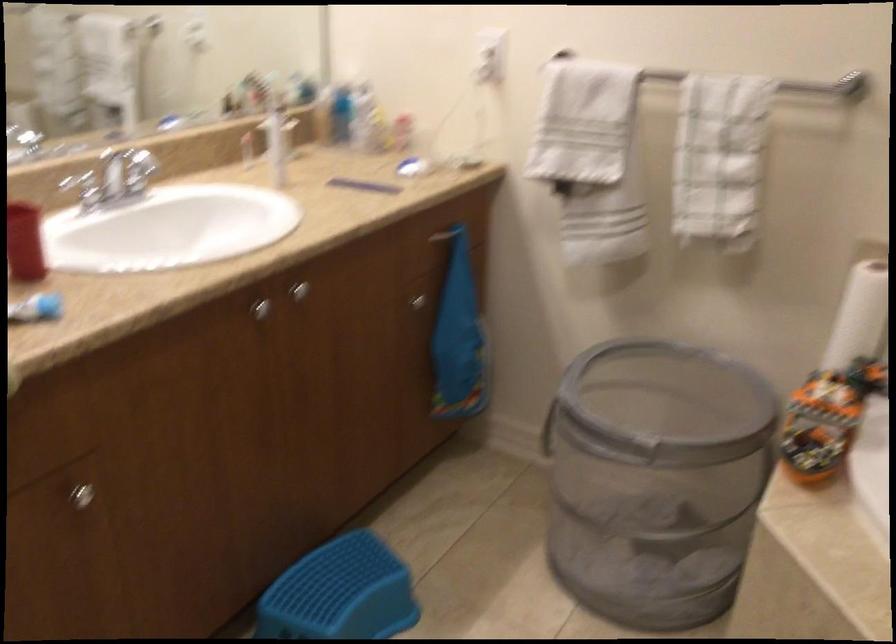
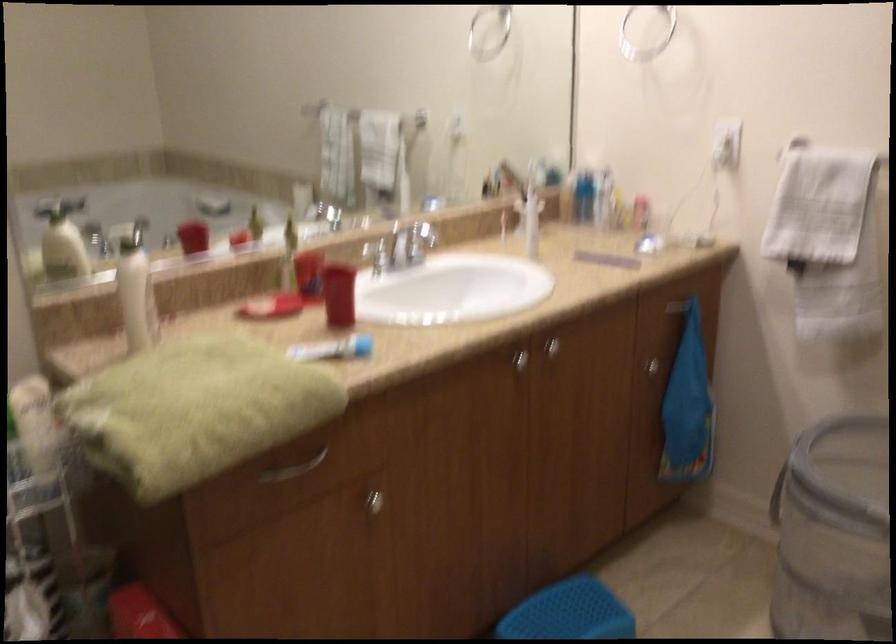
In the second image, find the point that corresponds to [600,466] in the first image.

(833, 533)